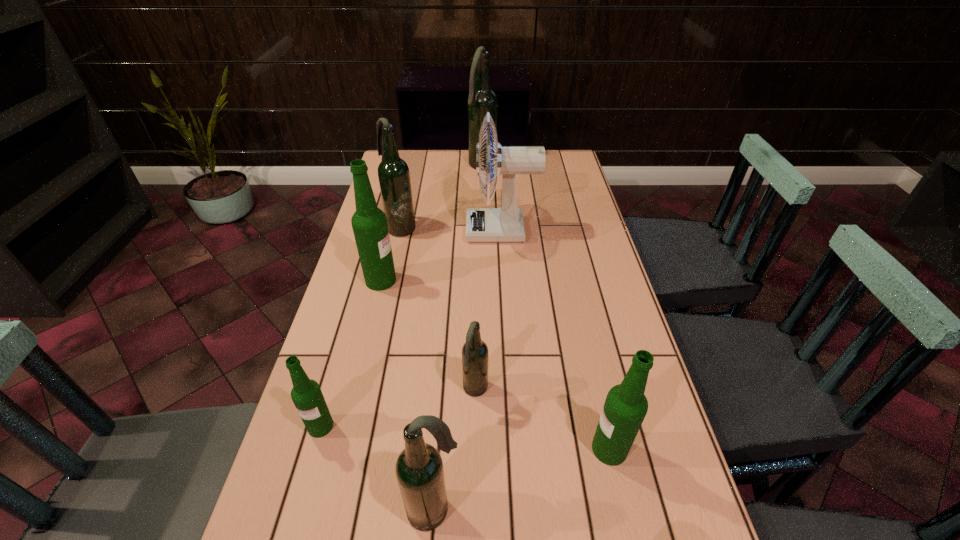
The height and width of the screenshot is (540, 960). In order to click on the nearest beer bottle in this screenshot , I will do `click(419, 469)`.

At what (x,y) coordinates should I click in order to perform the action: click on the smallest green beer bottle. Please return your answer as a coordinate pair (x, y). Image resolution: width=960 pixels, height=540 pixels. Looking at the image, I should click on (306, 394).

Locate an element on the screen. Image resolution: width=960 pixels, height=540 pixels. the fourth farthest beer bottle is located at coordinates (475, 352).

Where is `the smallest dark beer bottle`? This screenshot has height=540, width=960. the smallest dark beer bottle is located at coordinates (475, 352).

I want to click on vacant region located on the right of the tallest beer bottle, so click(x=534, y=166).

Identify the location of blank area located 0.320m on the front-facing side of the fan. (370, 231).

Identify the location of vacant area situated 0.250m on the front-facing side of the fan. This screenshot has height=540, width=960. (391, 231).

Identify the location of free space located 0.110m on the front-facing side of the fan. The height and width of the screenshot is (540, 960). (433, 231).

Where is `vacant space located on the label of the biggest green beer bottle`? This screenshot has height=540, width=960. vacant space located on the label of the biggest green beer bottle is located at coordinates point(496,280).

At what (x,y) coordinates should I click in order to perform the action: click on free space located on the back of the second farthest dark beer bottle. Please return your answer as a coordinate pair (x, y). Looking at the image, I should click on point(408,199).